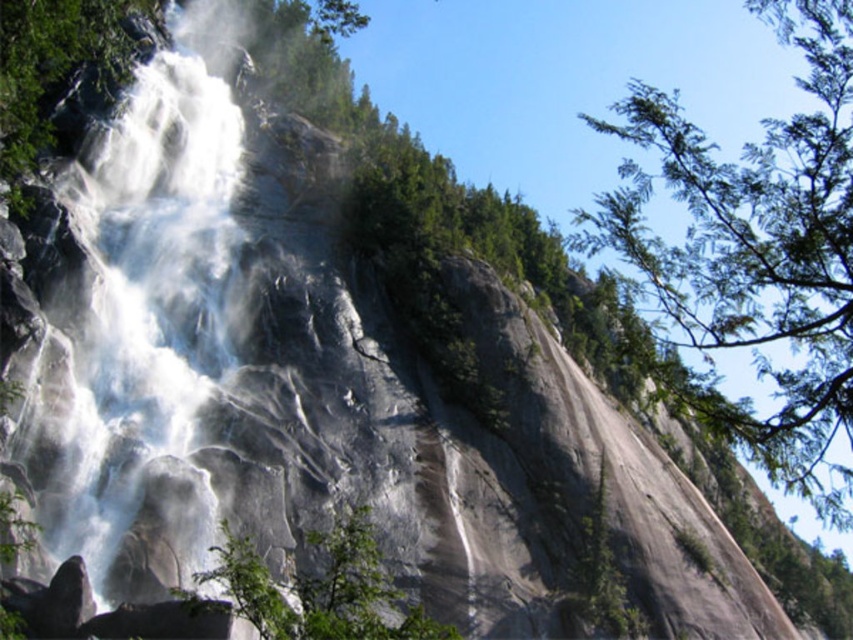
Question: Is green leafy tree at upper right positioned at the back of green leafy tree at center?

Choices:
 (A) no
 (B) yes

Answer: (B)

Question: Is green leafy tree at upper right wider than green leafy tree at center?

Choices:
 (A) yes
 (B) no

Answer: (A)

Question: Among these objects, which one is nearest to the camera?

Choices:
 (A) green leafy tree at center
 (B) green leafy tree at upper right

Answer: (A)

Question: Considering the real-world distances, which object is farthest from the white mist at center?

Choices:
 (A) green leafy tree at upper right
 (B) green leafy tree at center

Answer: (A)

Question: Among these points, which one is nearest to the camera?

Choices:
 (A) (248, 580)
 (B) (105, 540)

Answer: (A)

Question: Does green leafy tree at upper right have a lesser width compared to green leafy tree at center?

Choices:
 (A) no
 (B) yes

Answer: (A)